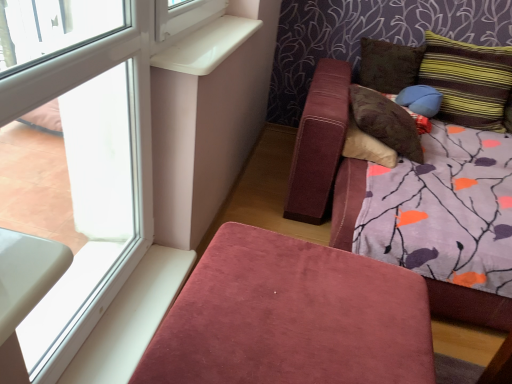
Question: Is transparent glass window at upper left at the right side of striped fabric pillow at upper right, which appears as the 4th pillow when viewed from the left?

Choices:
 (A) yes
 (B) no

Answer: (B)

Question: Does transparent glass window at upper left have a greater width compared to striped fabric pillow at upper right, which appears as the 1th pillow when viewed from the right?

Choices:
 (A) yes
 (B) no

Answer: (B)

Question: Does transparent glass window at upper left appear on the left side of striped fabric pillow at upper right, which appears as the 4th pillow when viewed from the left?

Choices:
 (A) no
 (B) yes

Answer: (B)

Question: Could you tell me if transparent glass window at upper left is turned towards striped fabric pillow at upper right, which appears as the 1th pillow when viewed from the right?

Choices:
 (A) yes
 (B) no

Answer: (B)

Question: Considering the relative sizes of transparent glass window at upper left and striped fabric pillow at upper right, which appears as the 1th pillow when viewed from the right, in the image provided, is transparent glass window at upper left shorter than striped fabric pillow at upper right, which appears as the 1th pillow when viewed from the right,?

Choices:
 (A) no
 (B) yes

Answer: (A)

Question: Is the depth of transparent glass window at upper left less than that of striped fabric pillow at upper right, which appears as the 1th pillow when viewed from the right?

Choices:
 (A) no
 (B) yes

Answer: (B)

Question: Is white plastic window sill at upper left far from transparent glass window at upper left?

Choices:
 (A) no
 (B) yes

Answer: (A)

Question: Are white plastic window sill at upper left and transparent glass window at upper left beside each other?

Choices:
 (A) yes
 (B) no

Answer: (B)

Question: From the image's perspective, would you say white plastic window sill at upper left is positioned over transparent glass window at upper left?

Choices:
 (A) no
 (B) yes

Answer: (B)

Question: From a real-world perspective, is white plastic window sill at upper left located beneath transparent glass window at upper left?

Choices:
 (A) yes
 (B) no

Answer: (B)

Question: Does white plastic window sill at upper left have a smaller size compared to transparent glass window at upper left?

Choices:
 (A) no
 (B) yes

Answer: (B)

Question: Is white plastic window sill at upper left to the right of transparent glass window at upper left from the viewer's perspective?

Choices:
 (A) yes
 (B) no

Answer: (A)

Question: Is blue fabric pillow at upper right, arranged as the second pillow when viewed from the right, positioned with its back to brown suede pillow at upper right, which appears as the second pillow when viewed from the left?

Choices:
 (A) yes
 (B) no

Answer: (A)